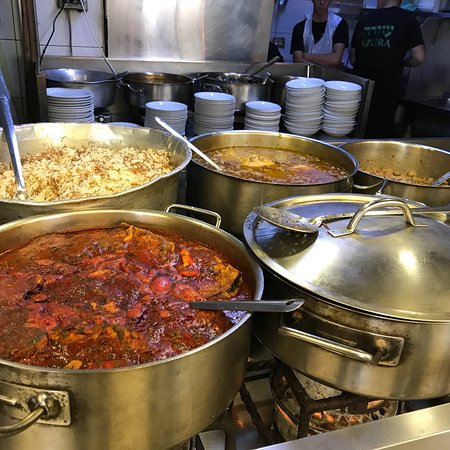
Locate an element on the screen. The height and width of the screenshot is (450, 450). spoon on pot lid is located at coordinates (308, 229).